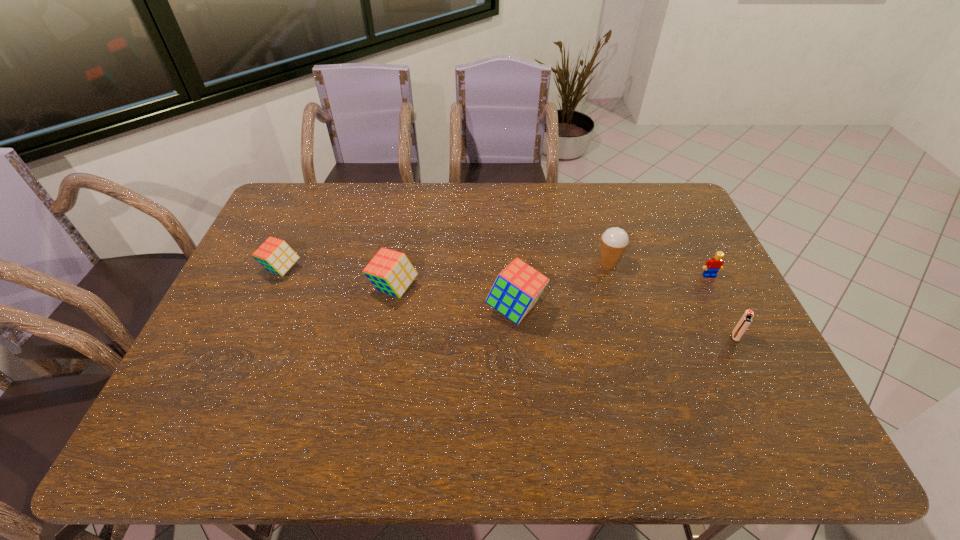
All cubes are currently evenly spaced. To continue this pattern, where would you add another cube on the right? Please point out a vacant spot. Please provide its 2D coordinates. Your answer should be formatted as a tuple, i.e. [(x, y)], where the tuple contains the x and y coordinates of a point satisfying the conditions above.

[(649, 331)]